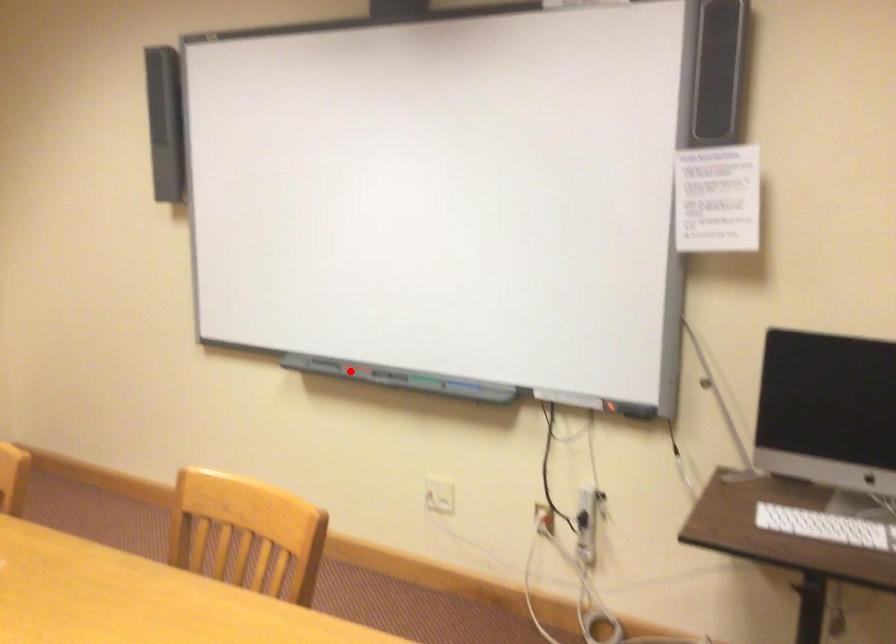
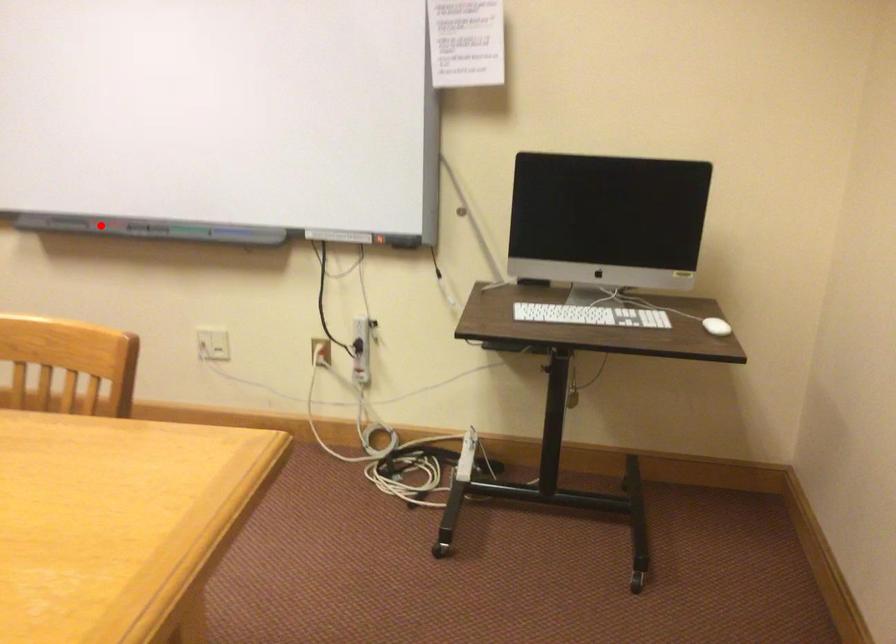
I am providing you with two images of the same scene from different viewpoints. A red point is marked on the first image and another point is marked on the second image. Is the marked point in image1 the same physical position as the marked point in image2?

Yes